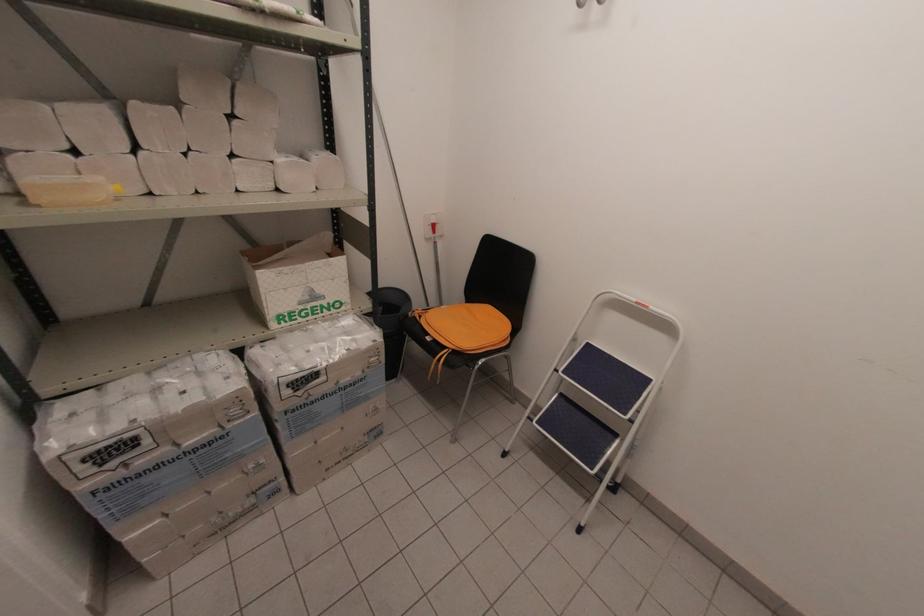
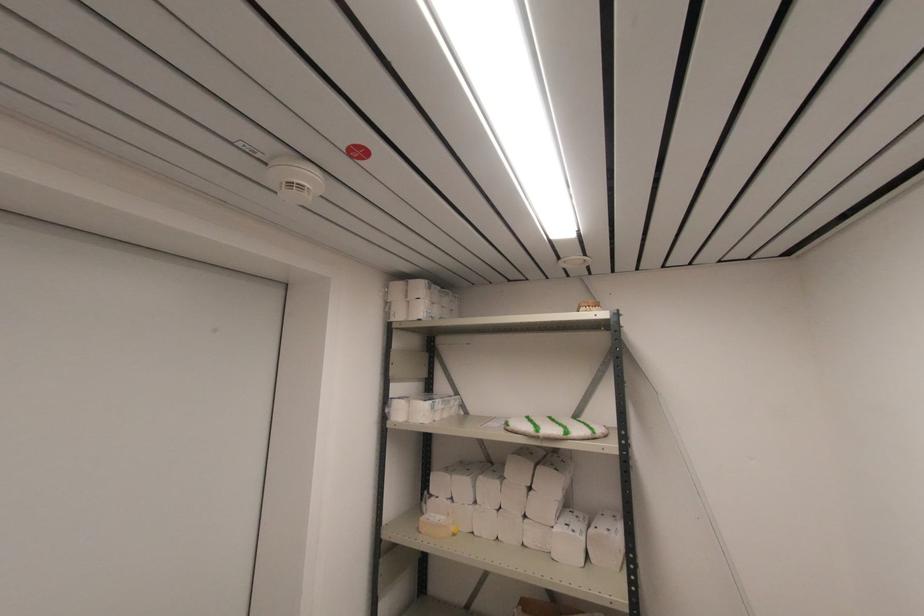
Find the pixel in the second image that matches point 40,207 in the first image.

(420, 533)